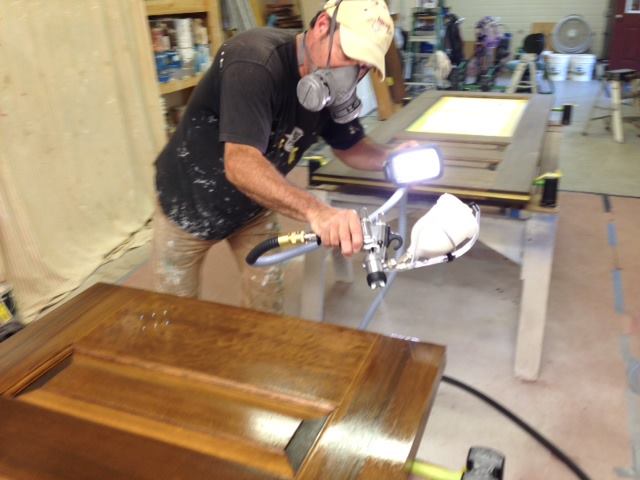
Where is `flooring`? The width and height of the screenshot is (640, 480). flooring is located at coordinates (x=579, y=400), (x=592, y=250), (x=595, y=157), (x=458, y=300), (x=136, y=273).